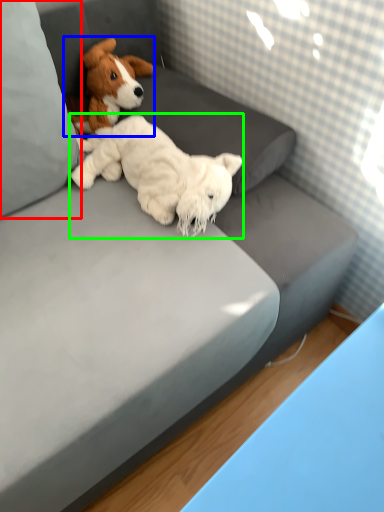
Question: Estimate the real-world distances between objects in this image. Which object is farther from pillow (highlighted by a red box), dog (highlighted by a blue box) or dog (highlighted by a green box)?

Choices:
 (A) dog
 (B) dog

Answer: (A)